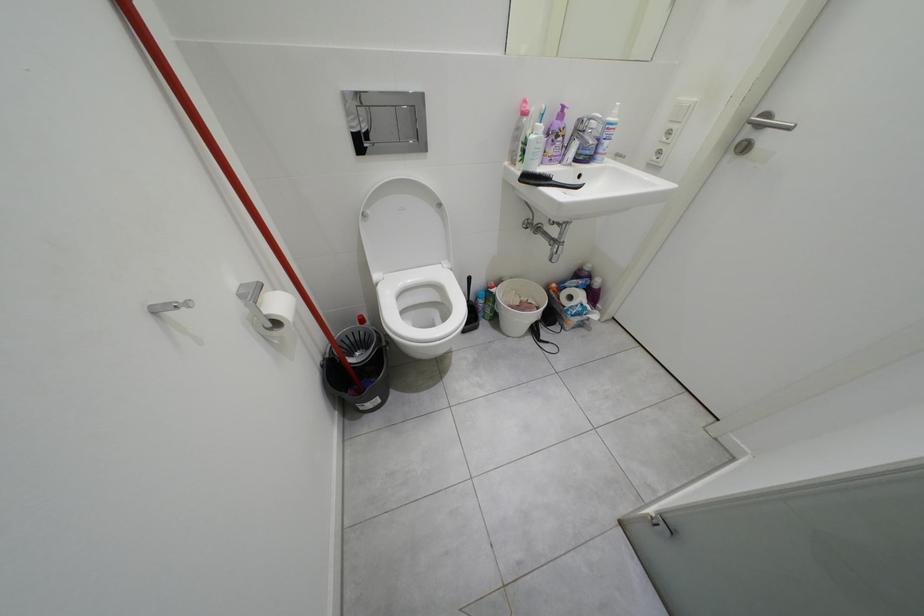
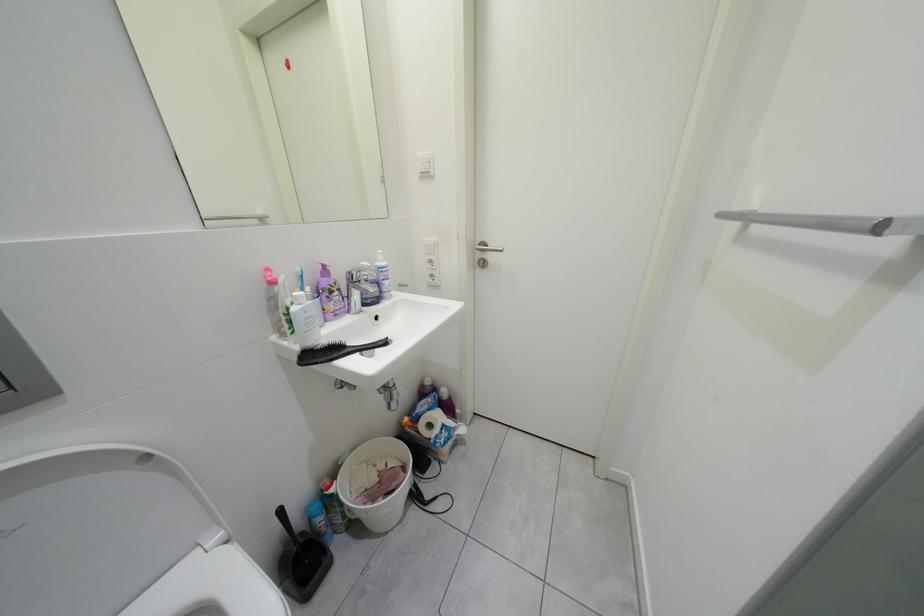
Question: The first image is from the beginning of the video and the second image is from the end. How did the camera likely rotate when shooting the video?

Choices:
 (A) Left
 (B) Right
 (C) Up
 (D) Down

Answer: (B)